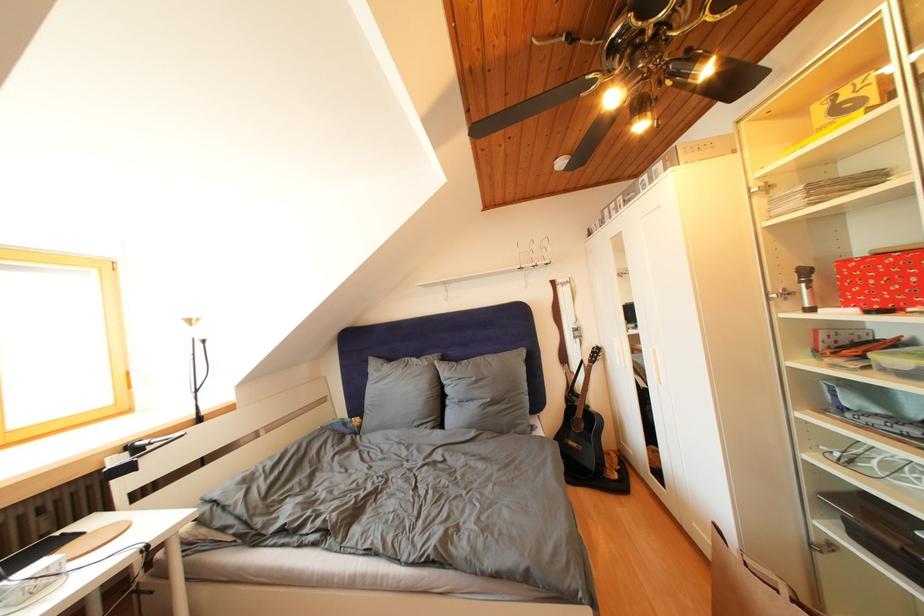
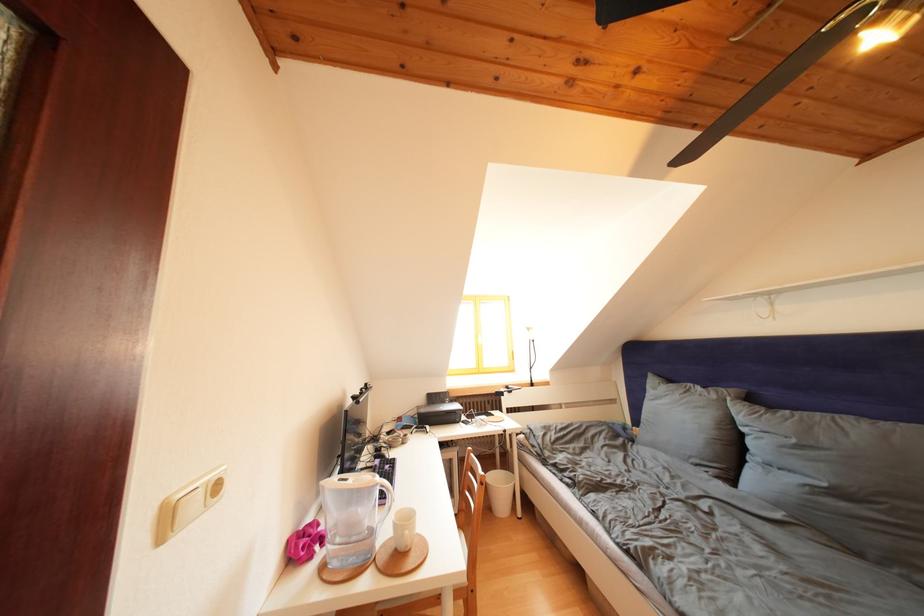
In the second image, find the point that corresponds to the point at 482,384 in the first image.

(801, 446)